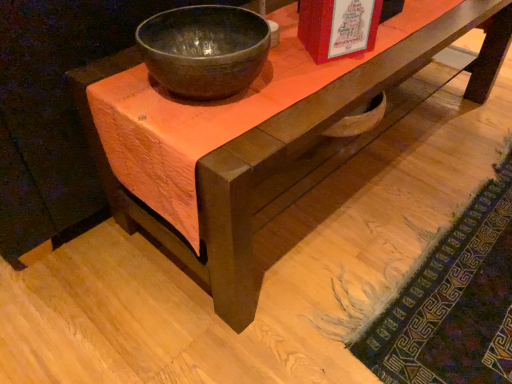
Find the location of a particular element. This screenshot has height=384, width=512. unoccupied region to the right of matte dark gray bowl at center is located at coordinates (307, 84).